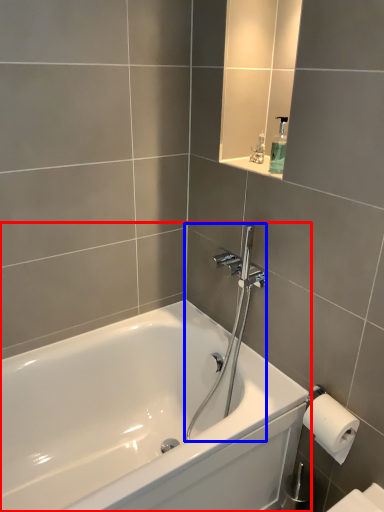
Question: Which object appears closest to the camera in this image, bathtub (highlighted by a red box) or shower (highlighted by a blue box)?

Choices:
 (A) bathtub
 (B) shower

Answer: (A)